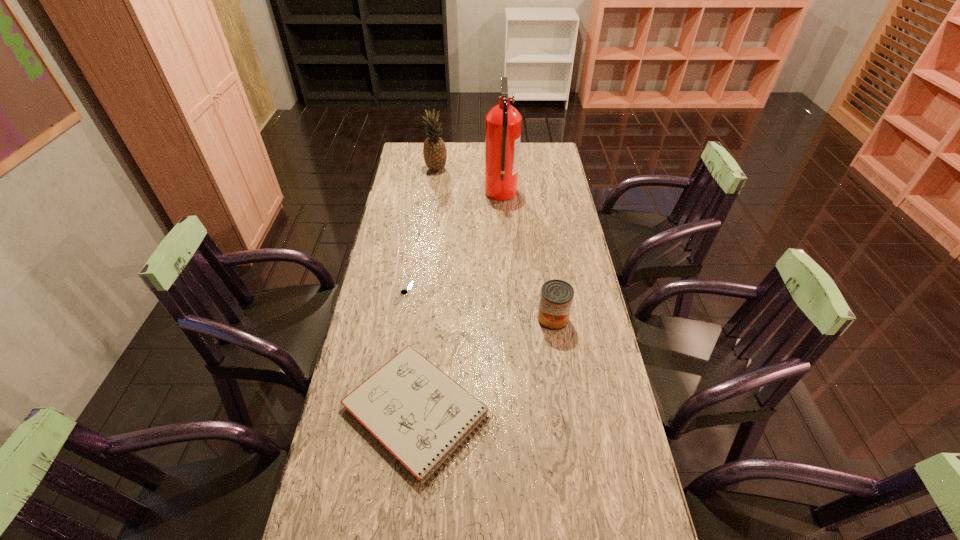
The width and height of the screenshot is (960, 540). What are the coordinates of `vacant space positioned at the nozzle of the second farthest object` in the screenshot? It's located at (455, 193).

Where is `free space located 0.340m at the nozzle of the second farthest object`? The height and width of the screenshot is (540, 960). free space located 0.340m at the nozzle of the second farthest object is located at coordinates (407, 193).

Locate an element on the screen. vacant space situated at the nozzle of the second farthest object is located at coordinates (427, 193).

Locate an element on the screen. This screenshot has height=540, width=960. vacant space located on the back of the farthest object is located at coordinates pyautogui.click(x=439, y=151).

This screenshot has height=540, width=960. I want to click on free point located 0.370m on the left of the third tallest object, so click(423, 319).

Locate an element on the screen. This screenshot has height=540, width=960. vacant region located on the back of the second shortest object is located at coordinates (429, 303).

At what (x,y) coordinates should I click in order to perform the action: click on free space located on the front of the watch. Please return your answer as a coordinate pair (x, y). This screenshot has width=960, height=540. Looking at the image, I should click on (397, 336).

At what (x,y) coordinates should I click in order to perform the action: click on object located in the far edge section of the desktop. Please return your answer as a coordinate pair (x, y). Looking at the image, I should click on (434, 150).

Where is `pineapple present at the left edge`? This screenshot has height=540, width=960. pineapple present at the left edge is located at coordinates click(434, 150).

This screenshot has width=960, height=540. What are the coordinates of `notepad present at the left edge` in the screenshot? It's located at (420, 415).